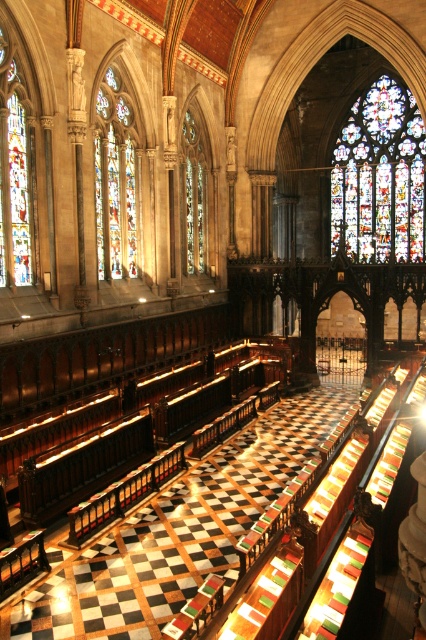
Question: Does stained glass at upper center appear on the left side of stained glass window at center?

Choices:
 (A) no
 (B) yes

Answer: (A)

Question: Can you confirm if stained glass at upper center is thinner than stained glass window at center?

Choices:
 (A) yes
 (B) no

Answer: (B)

Question: Which point appears closest to the camera in this image?

Choices:
 (A) (356, 237)
 (B) (25, 163)

Answer: (B)

Question: Is the position of stained glass window at center less distant than that of stained glass window at left?

Choices:
 (A) no
 (B) yes

Answer: (A)

Question: Which point appears closest to the camera in this image?

Choices:
 (A) (396, 145)
 (B) (31, 195)
 (C) (118, 124)

Answer: (B)

Question: Which is farther from the stained glass window at center?

Choices:
 (A) stained glass at upper center
 (B) stained glass window at left

Answer: (A)